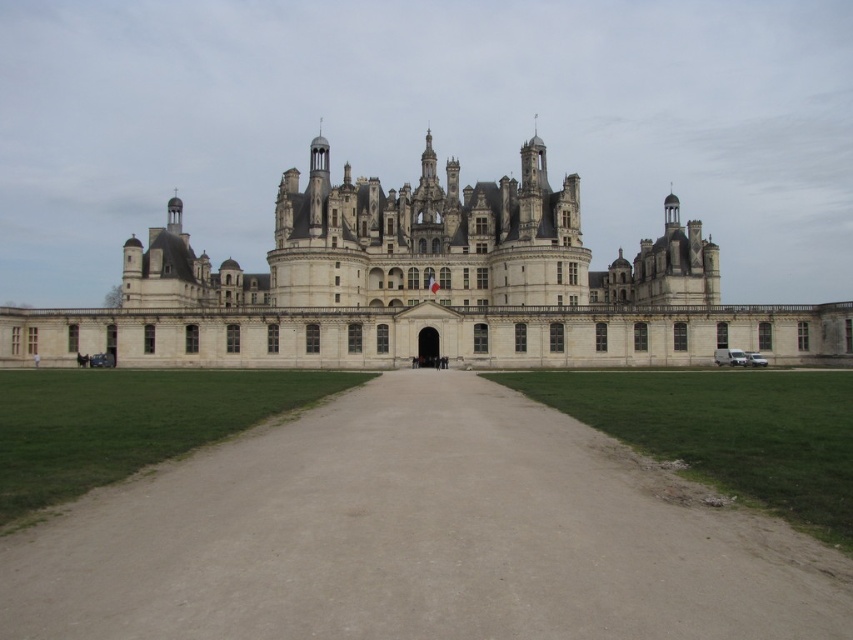
Can you confirm if dirt path at center is wider than white stone castle at center?

In fact, dirt path at center might be narrower than white stone castle at center.

In the scene shown: Does dirt path at center appear on the left side of white stone castle at center?

No, dirt path at center is not to the left of white stone castle at center.

Where is `dirt path at center`? This screenshot has width=853, height=640. dirt path at center is located at coordinates (416, 538).